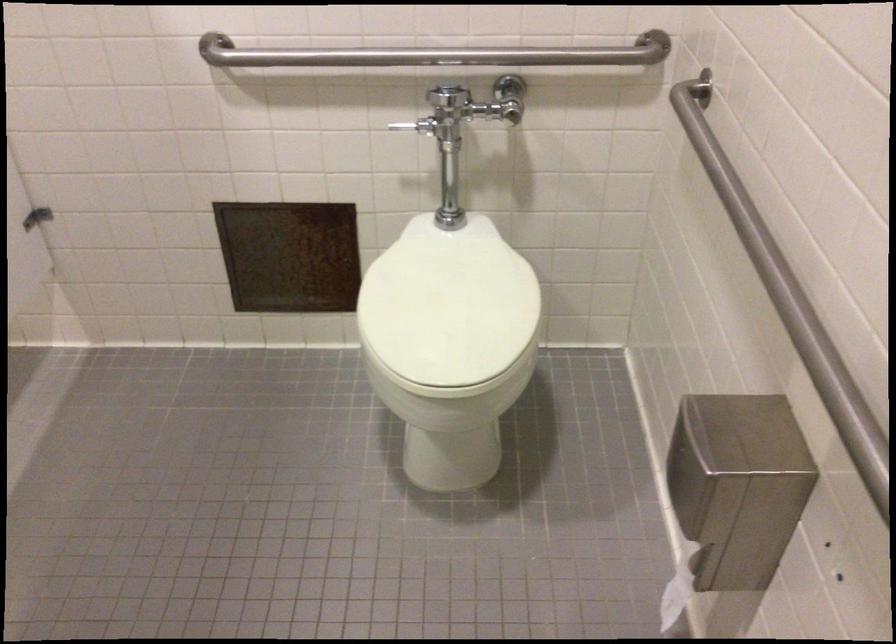
Locate an element on the screen. This screenshot has width=896, height=644. white toilet paper is located at coordinates [x=679, y=587].